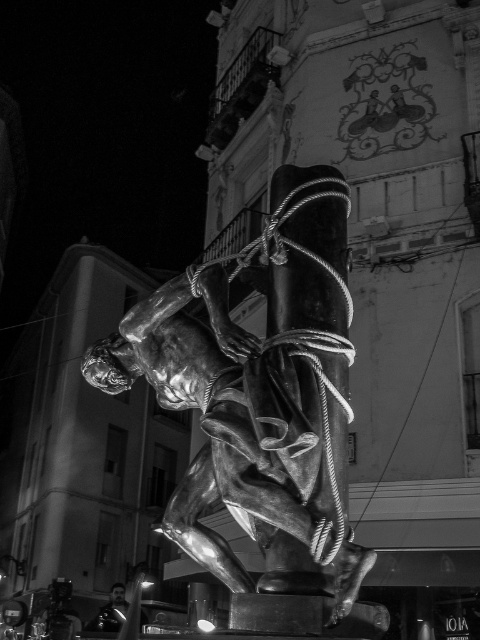
Question: Which point is farther from the camera taking this photo?

Choices:
 (A) (104, 618)
 (B) (347, 195)

Answer: (A)

Question: Does shiny bronze statue at center have a greater width compared to shiny black helmet at lower left?

Choices:
 (A) no
 (B) yes

Answer: (B)

Question: Can you confirm if shiny bronze statue at center is positioned to the right of shiny black helmet at lower left?

Choices:
 (A) no
 (B) yes

Answer: (B)

Question: Which point is closer to the camera?

Choices:
 (A) (107, 611)
 (B) (228, 317)

Answer: (B)

Question: Does shiny bronze statue at center appear over shiny black helmet at lower left?

Choices:
 (A) no
 (B) yes

Answer: (B)